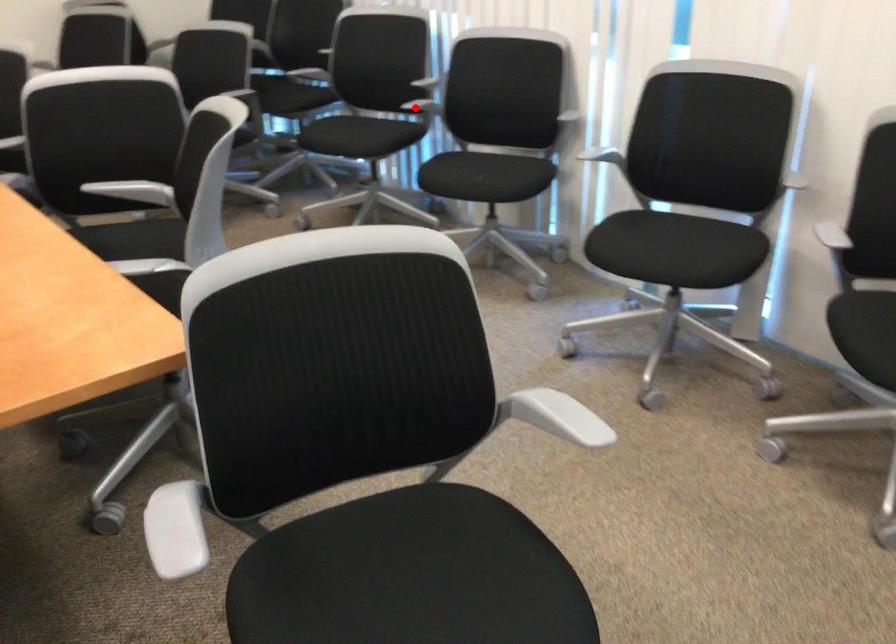
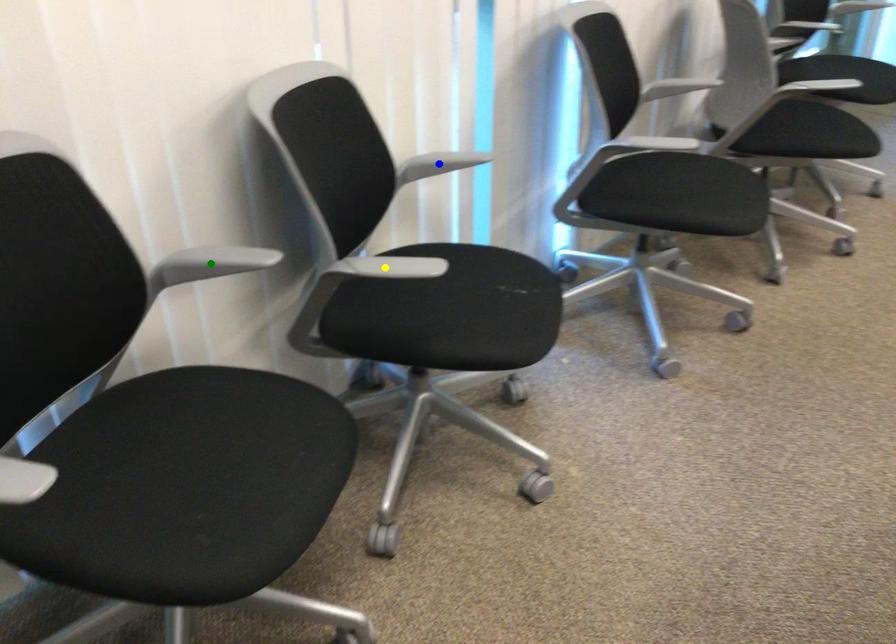
Question: I am providing you with two images of the same scene from different viewpoints. A red point is marked on the first image. You are given multiple points on the second image. Which mark in image 2 goes with the point in image 1?

Choices:
 (A) blue point
 (B) green point
 (C) yellow point

Answer: (C)